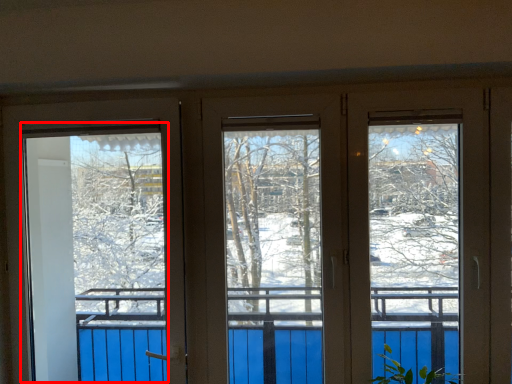
Question: Observing the image, what is the correct spatial positioning of screen door (annotated by the red box) in reference to plant?

Choices:
 (A) right
 (B) left

Answer: (B)